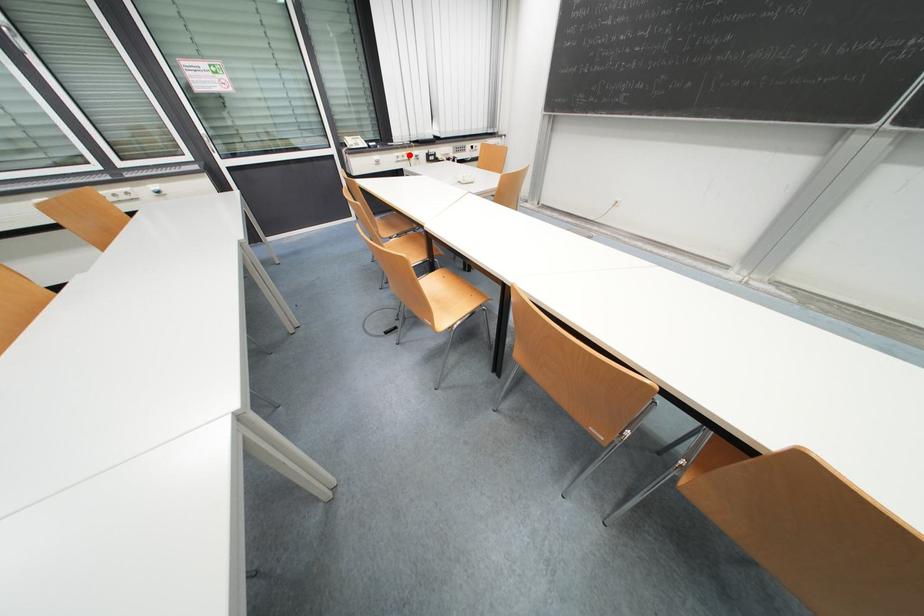
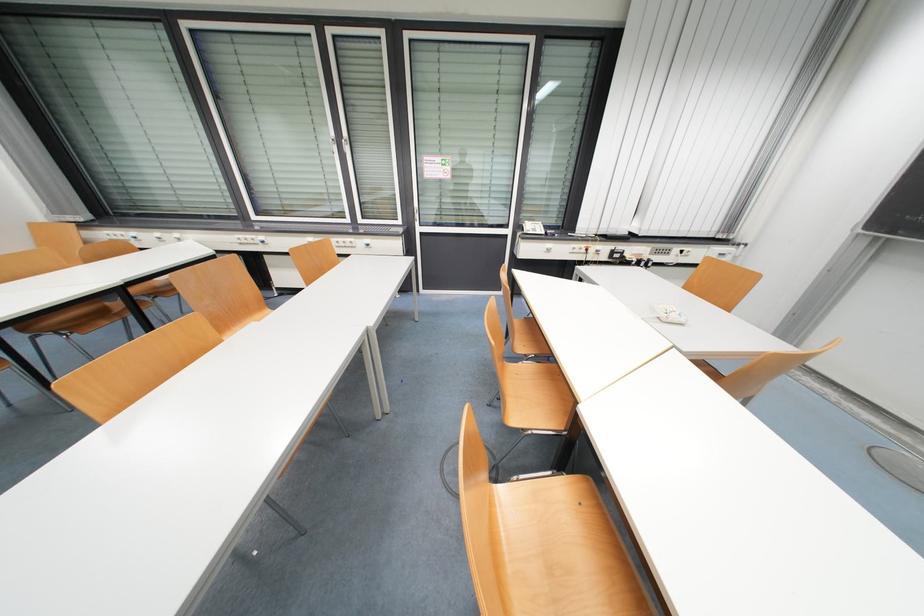
The point at the highlighted location is marked in the first image. Where is the corresponding point in the second image?

(589, 246)